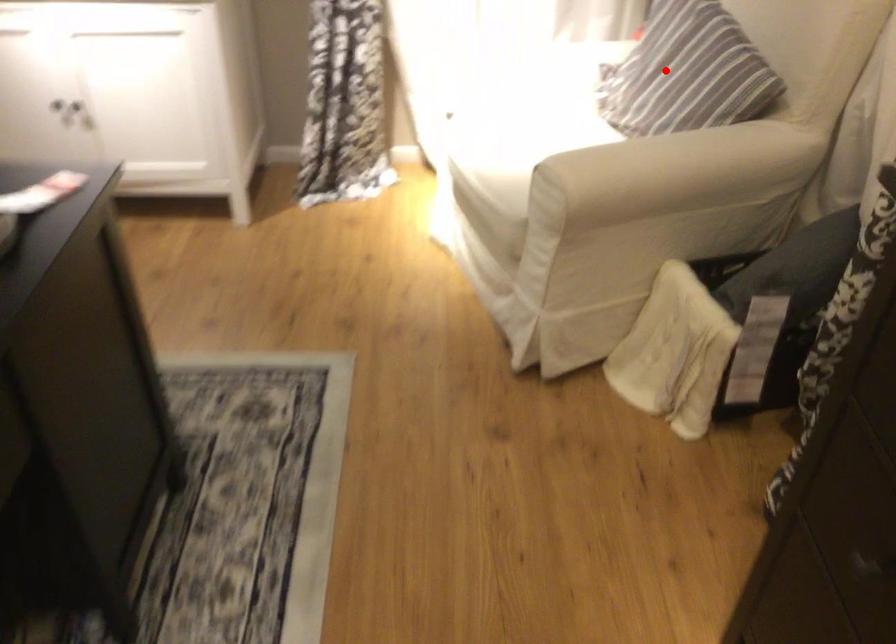
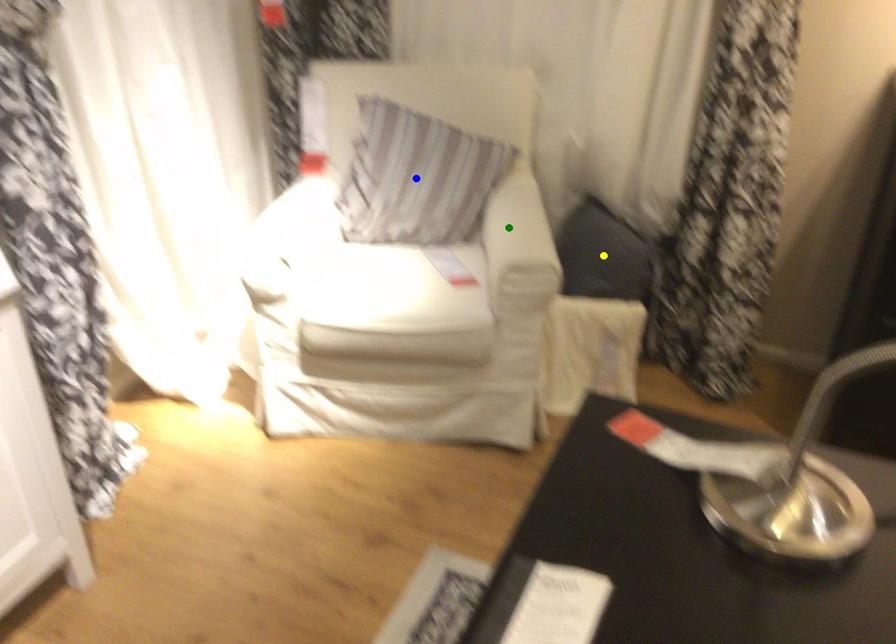
Question: I am providing you with two images of the same scene from different viewpoints. A red point is marked on the first image. You are given multiple points on the second image. Can you choose the point in image 2 that corresponds to the point in image 1?

Choices:
 (A) yellow point
 (B) green point
 (C) blue point

Answer: (C)